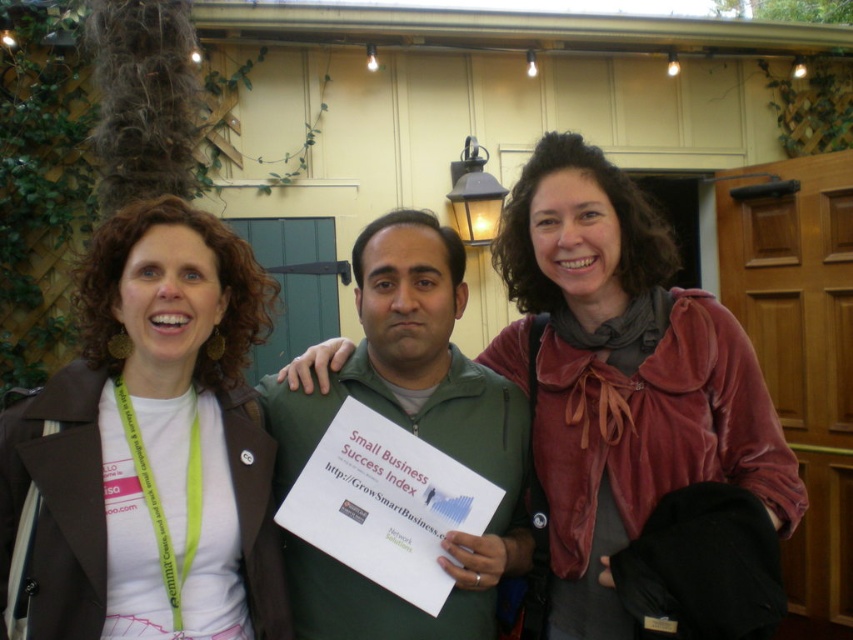
You are organizing a photo shoot and need to ensure that the velvet red scarf at center and the green matte jacket at center are both visible in the frame. Given their sizes, which one might require more careful positioning to avoid being cut off?

The velvet red scarf at center has a larger size compared to the green matte jacket at center, so it might require more careful positioning to avoid being cut off.

You are at an evening event with string lights. You see a matte brown jacket at left and a velvet red scarf at center. Which item is located more to the left?

The matte brown jacket at left is positioned on the left side of the velvet red scarf at center, so it is more to the left.

You are attending an evening event with string lights overhead. You notice two jackets in the crowd. The matte brown jacket at left and the green matte jacket at center. Which jacket is positioned higher relative to the other?

The matte brown jacket at left is located above the green matte jacket at center.